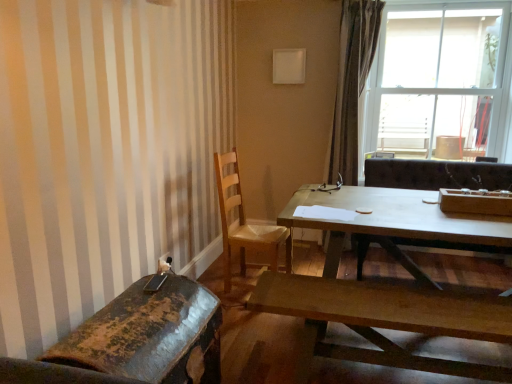
Describe the element at coordinates (140, 339) in the screenshot. I see `rusty metal chair at lower left, which is counted as the 1th chair, starting from the front` at that location.

What are the coordinates of `light brown wooden table at center, which is the first coffee table from back to front` in the screenshot? It's located at point(393,222).

The width and height of the screenshot is (512, 384). I want to click on wooden chair at center, arranged as the 1th chair when viewed from the back, so click(244, 222).

Describe the element at coordinates (244, 222) in the screenshot. The image size is (512, 384). I see `wooden chair at center, arranged as the 1th chair when viewed from the back` at that location.

Describe the element at coordinates (438, 81) in the screenshot. The image size is (512, 384). I see `transparent glass window at upper right` at that location.

Where is `wooden bench at lower center, the 2th coffee table viewed from the back`? wooden bench at lower center, the 2th coffee table viewed from the back is located at coordinates (387, 319).

Where is `brown textured curtain at upper right`? brown textured curtain at upper right is located at coordinates (352, 85).

Which is nearer, (245, 273) or (441, 77)?

Clearly, point (245, 273) is closer to the camera than point (441, 77).

From a real-world perspective, is wooden chair at center, arranged as the 1th chair when viewed from the back, positioned under transparent glass window at upper right based on gravity?

Yes, from a real-world perspective, wooden chair at center, arranged as the 1th chair when viewed from the back, is below transparent glass window at upper right.

Considering the sizes of objects wooden chair at center, the 2th chair viewed from the front, and transparent glass window at upper right in the image provided, who is wider, wooden chair at center, the 2th chair viewed from the front, or transparent glass window at upper right?

transparent glass window at upper right.

Considering the sizes of transparent glass window at upper right and wooden bench at lower center, the 2th coffee table viewed from the back, in the image, is transparent glass window at upper right wider or thinner than wooden bench at lower center, the 2th coffee table viewed from the back,?

Clearly, transparent glass window at upper right has more width compared to wooden bench at lower center, the 2th coffee table viewed from the back.

Could you tell me if transparent glass window at upper right is facing wooden bench at lower center, which appears as the first coffee table when viewed from the front?

No, transparent glass window at upper right is not facing towards wooden bench at lower center, which appears as the first coffee table when viewed from the front.

From a real-world perspective, relative to wooden bench at lower center, the 2th coffee table viewed from the back, is transparent glass window at upper right vertically above or below?

In terms of real-world spatial position, transparent glass window at upper right is above wooden bench at lower center, the 2th coffee table viewed from the back.

Looking at this image, is transparent glass window at upper right shorter than wooden bench at lower center, the 2th coffee table viewed from the back?

In fact, transparent glass window at upper right may be taller than wooden bench at lower center, the 2th coffee table viewed from the back.

From a real-world perspective, is light brown wooden table at center, placed as the 2th coffee table when sorted from front to back, positioned under brown textured curtain at upper right based on gravity?

Yes.

Does light brown wooden table at center, which is the first coffee table from back to front, have a smaller size compared to brown textured curtain at upper right?

No.

Between point (501, 239) and point (359, 55), which one is positioned behind?

The point (359, 55) is farther.

You are a GUI agent. You are given a task and a screenshot of the screen. Output one action in this format:
    pyautogui.click(x=<x>, y=<y>)
    Task: Click on the curtain lying on the left of light brown wooden table at center, placed as the 2th coffee table when sorted from front to back
    The height and width of the screenshot is (384, 512).
    Given the screenshot: What is the action you would take?
    pyautogui.click(x=352, y=85)

From a real-world perspective, who is located higher, brown textured curtain at upper right or wooden chair at center, the 2th chair viewed from the front?

brown textured curtain at upper right, from a real-world perspective.

Is brown textured curtain at upper right oriented away from wooden chair at center, arranged as the 1th chair when viewed from the back?

No.

Are brown textured curtain at upper right and rusty metal chair at lower left, the 2th chair positioned from the back, far apart?

Indeed, brown textured curtain at upper right is not near rusty metal chair at lower left, the 2th chair positioned from the back.

Which object is wider, brown textured curtain at upper right or rusty metal chair at lower left, which is counted as the 1th chair, starting from the front?

rusty metal chair at lower left, which is counted as the 1th chair, starting from the front, is wider.

From the picture: Which of these two, brown textured curtain at upper right or rusty metal chair at lower left, which is counted as the 1th chair, starting from the front, stands shorter?

rusty metal chair at lower left, which is counted as the 1th chair, starting from the front.

Between brown textured curtain at upper right and rusty metal chair at lower left, which is counted as the 1th chair, starting from the front, which one has larger size?

With larger size is brown textured curtain at upper right.

Image resolution: width=512 pixels, height=384 pixels. There is a transparent glass window at upper right. Identify the location of the 1st chair below it (from the image's perspective). (244, 222).

From a real-world perspective, is transparent glass window at upper right physically located above or below wooden chair at center, the 2th chair viewed from the front?

From a real-world perspective, transparent glass window at upper right is physically above wooden chair at center, the 2th chair viewed from the front.

Which is in front, transparent glass window at upper right or wooden chair at center, the 2th chair viewed from the front?

wooden chair at center, the 2th chair viewed from the front, is closer to the camera.

Considering the positions of points (232, 239) and (346, 104), is point (232, 239) closer to camera compared to point (346, 104)?

Yes, it is in front of point (346, 104).

From the image's perspective, does wooden chair at center, arranged as the 1th chair when viewed from the back, appear lower than brown textured curtain at upper right?

Indeed, from the image's perspective, wooden chair at center, arranged as the 1th chair when viewed from the back, is shown beneath brown textured curtain at upper right.

Who is more distant, wooden chair at center, arranged as the 1th chair when viewed from the back, or brown textured curtain at upper right?

brown textured curtain at upper right is behind.

Consider the image. Is wooden chair at center, arranged as the 1th chair when viewed from the back, taller or shorter than brown textured curtain at upper right?

In the image, wooden chair at center, arranged as the 1th chair when viewed from the back, appears to be shorter than brown textured curtain at upper right.

From the image's perspective, which chair is the 1st one below the transparent glass window at upper right? Please provide its 2D coordinates.

[(244, 222)]

Where is `window above the wooden bench at lower center, the 2th coffee table viewed from the back (from the image's perspective)`? The width and height of the screenshot is (512, 384). window above the wooden bench at lower center, the 2th coffee table viewed from the back (from the image's perspective) is located at coordinates (438, 81).

When comparing their distances from transparent glass window at upper right, does rusty metal chair at lower left, which is counted as the 1th chair, starting from the front, or light brown wooden table at center, which is the first coffee table from back to front, seem further?

rusty metal chair at lower left, which is counted as the 1th chair, starting from the front, lies further to transparent glass window at upper right than the other object.

Looking at the image, which one is located further to wooden chair at center, arranged as the 1th chair when viewed from the back, light brown wooden table at center, which is the first coffee table from back to front, or rusty metal chair at lower left, the 2th chair positioned from the back?

Based on the image, rusty metal chair at lower left, the 2th chair positioned from the back, appears to be further to wooden chair at center, arranged as the 1th chair when viewed from the back.

From the image, which object appears to be nearer to transparent glass window at upper right, rusty metal chair at lower left, which is counted as the 1th chair, starting from the front, or wooden chair at center, the 2th chair viewed from the front?

wooden chair at center, the 2th chair viewed from the front, lies closer to transparent glass window at upper right than the other object.

Based on their spatial positions, is rusty metal chair at lower left, which is counted as the 1th chair, starting from the front, or transparent glass window at upper right further from brown textured curtain at upper right?

rusty metal chair at lower left, which is counted as the 1th chair, starting from the front, is further to brown textured curtain at upper right.

When comparing their distances from wooden chair at center, the 2th chair viewed from the front, does light brown wooden table at center, placed as the 2th coffee table when sorted from front to back, or brown textured curtain at upper right seem closer?

The object closer to wooden chair at center, the 2th chair viewed from the front, is light brown wooden table at center, placed as the 2th coffee table when sorted from front to back.

Estimate the real-world distances between objects in this image. Which object is further from transparent glass window at upper right, brown textured curtain at upper right or light brown wooden table at center, which is the first coffee table from back to front?

light brown wooden table at center, which is the first coffee table from back to front, is positioned further to the anchor transparent glass window at upper right.

From the picture: Which object lies further to the anchor point wooden chair at center, arranged as the 1th chair when viewed from the back, transparent glass window at upper right or light brown wooden table at center, placed as the 2th coffee table when sorted from front to back?

Based on the image, transparent glass window at upper right appears to be further to wooden chair at center, arranged as the 1th chair when viewed from the back.

From the image, which object appears to be nearer to transparent glass window at upper right, wooden chair at center, the 2th chair viewed from the front, or wooden bench at lower center, which appears as the first coffee table when viewed from the front?

wooden chair at center, the 2th chair viewed from the front, lies closer to transparent glass window at upper right than the other object.

Where is `coffee table located between wooden chair at center, the 2th chair viewed from the front, and light brown wooden table at center, placed as the 2th coffee table when sorted from front to back, in the left-right direction`? Image resolution: width=512 pixels, height=384 pixels. coffee table located between wooden chair at center, the 2th chair viewed from the front, and light brown wooden table at center, placed as the 2th coffee table when sorted from front to back, in the left-right direction is located at coordinates (387, 319).

Locate an element on the screen. The image size is (512, 384). window between rusty metal chair at lower left, the 2th chair positioned from the back, and brown textured curtain at upper right, along the z-axis is located at coordinates (438, 81).

Find the location of a particular element. This screenshot has width=512, height=384. chair situated between rusty metal chair at lower left, which is counted as the 1th chair, starting from the front, and transparent glass window at upper right from left to right is located at coordinates 244,222.

At what (x,y) coordinates should I click in order to perform the action: click on chair between light brown wooden table at center, placed as the 2th coffee table when sorted from front to back, and brown textured curtain at upper right from front to back. Please return your answer as a coordinate pair (x, y). The width and height of the screenshot is (512, 384). Looking at the image, I should click on (x=244, y=222).